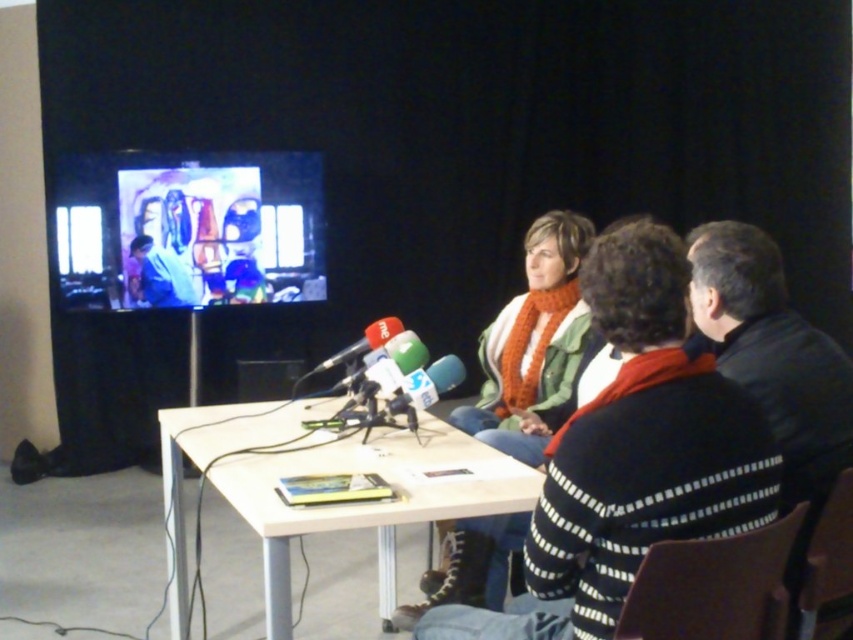
Does point (515, 321) come in front of point (173, 289)?

Yes, point (515, 321) is closer to viewer.

Is point (561, 304) farther from camera compared to point (170, 296)?

No, it is in front of (170, 296).

Identify the location of knitted orange scarf at center. (534, 346).

Which is above, white plastic table at center or smooth blue shirt at center?

Positioned higher is smooth blue shirt at center.

Who is more distant from viewer, (479, 490) or (140, 248)?

The point (140, 248) is more distant.

Who is more distant from viewer, (170, 589) or (161, 259)?

The point (161, 259) is behind.

Find the location of a particular element. The image size is (853, 640). white plastic table at center is located at coordinates (326, 472).

Is white plastic table at center bigger than knitted orange scarf at center?

Yes.

Does point (396, 448) come farther from viewer compared to point (517, 400)?

That is False.

At what (x,y) coordinates should I click in order to perform the action: click on white plastic table at center. Please return your answer as a coordinate pair (x, y). This screenshot has width=853, height=640. Looking at the image, I should click on (326, 472).

Where is `white plastic table at center`? white plastic table at center is located at coordinates (326, 472).